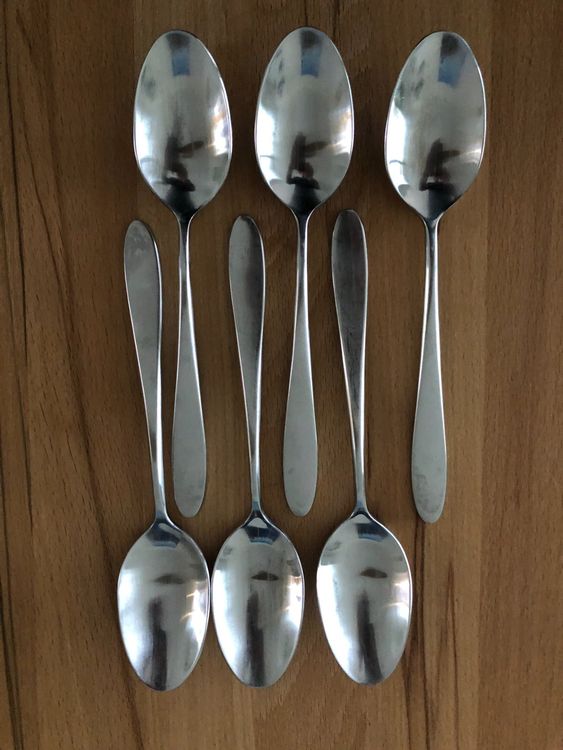
This screenshot has height=750, width=563. Identify the location of spoons. (182, 625), (279, 602), (355, 600), (194, 127), (319, 115), (404, 121).